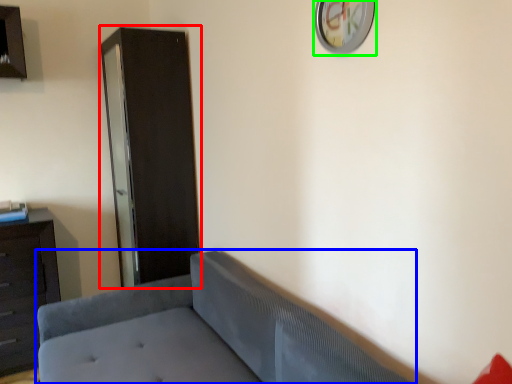
Question: Considering the real-world distances, which object is farthest from file cabinet (highlighted by a red box)? studio couch (highlighted by a blue box) or clock (highlighted by a green box)?

Choices:
 (A) studio couch
 (B) clock

Answer: (B)